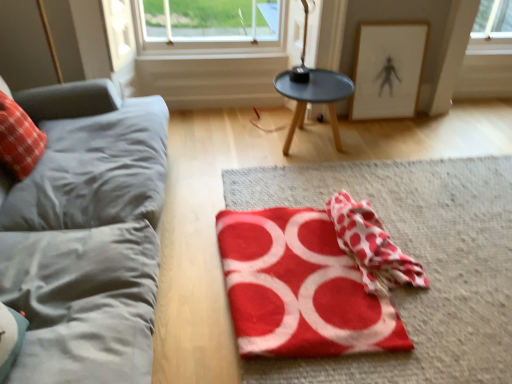
Question: Would you say red fabric at center is outside white paper picture frame at upper right?

Choices:
 (A) yes
 (B) no

Answer: (A)

Question: From the image's perspective, is red fabric at center below white paper picture frame at upper right?

Choices:
 (A) yes
 (B) no

Answer: (A)

Question: Can you confirm if red fabric at center is taller than white paper picture frame at upper right?

Choices:
 (A) no
 (B) yes

Answer: (A)

Question: Is the surface of red fabric at center in direct contact with white paper picture frame at upper right?

Choices:
 (A) no
 (B) yes

Answer: (A)

Question: Does red fabric at center have a smaller size compared to white paper picture frame at upper right?

Choices:
 (A) yes
 (B) no

Answer: (B)

Question: From a real-world perspective, is red fabric at center beneath white paper picture frame at upper right?

Choices:
 (A) yes
 (B) no

Answer: (A)

Question: Is white paper picture frame at upper right aimed at black matte table at center?

Choices:
 (A) yes
 (B) no

Answer: (B)

Question: Is white paper picture frame at upper right to the right of black matte table at center from the viewer's perspective?

Choices:
 (A) no
 (B) yes

Answer: (B)

Question: Is white paper picture frame at upper right turned away from black matte table at center?

Choices:
 (A) no
 (B) yes

Answer: (A)

Question: From the image's perspective, is white paper picture frame at upper right under black matte table at center?

Choices:
 (A) yes
 (B) no

Answer: (B)

Question: Considering the relative sizes of white paper picture frame at upper right and black matte table at center in the image provided, is white paper picture frame at upper right taller than black matte table at center?

Choices:
 (A) yes
 (B) no

Answer: (A)

Question: From a real-world perspective, is white paper picture frame at upper right physically below black matte table at center?

Choices:
 (A) yes
 (B) no

Answer: (B)

Question: Is red fabric at center bigger than red felt yoga mat at center?

Choices:
 (A) no
 (B) yes

Answer: (B)